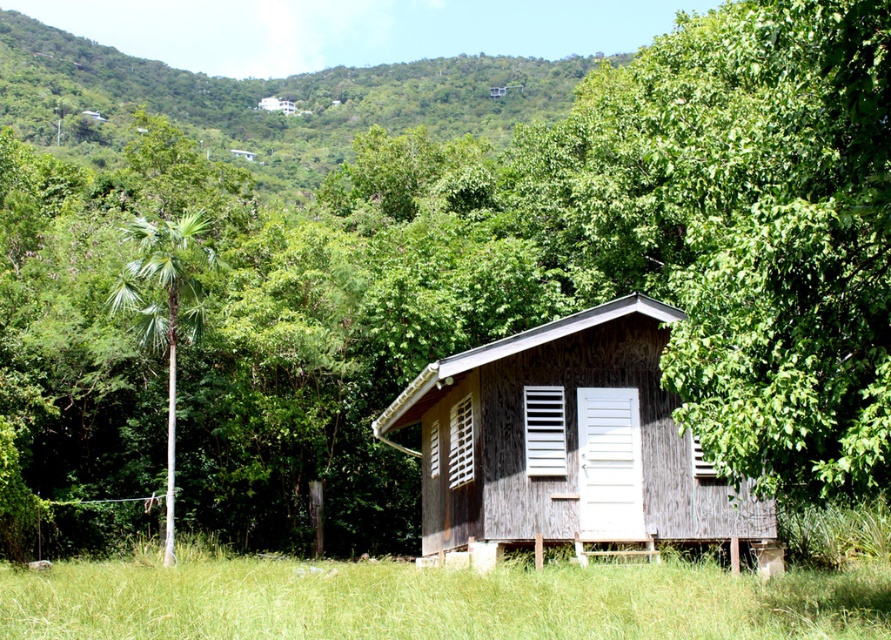
Who is shorter, green grass at lower center or green leafy palm tree at left?

Standing shorter between the two is green grass at lower center.

In order to click on green grass at lower center in this screenshot , I will do `click(436, 600)`.

The height and width of the screenshot is (640, 891). Describe the element at coordinates (436, 600) in the screenshot. I see `green grass at lower center` at that location.

Identify the location of green grass at lower center. The width and height of the screenshot is (891, 640). (436, 600).

Which is below, green grass at lower center or wooden slats at center?

green grass at lower center is lower down.

Who is more distant from viewer, (143, 588) or (466, 477)?

Point (466, 477)

Does point (607, 580) come closer to viewer compared to point (462, 460)?

Yes, it is in front of point (462, 460).

In order to click on green grass at lower center in this screenshot , I will do `click(436, 600)`.

Is point (628, 536) positioned before point (593, 429)?

Yes.

Can you confirm if weathered wood hut at center is positioned to the right of white wooden door at center?

No, weathered wood hut at center is not to the right of white wooden door at center.

Describe the element at coordinates (570, 440) in the screenshot. I see `weathered wood hut at center` at that location.

The width and height of the screenshot is (891, 640). I want to click on weathered wood hut at center, so click(x=570, y=440).